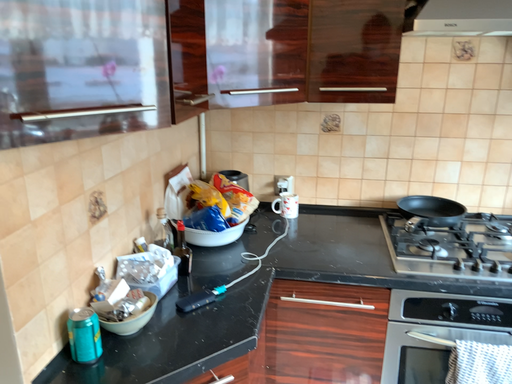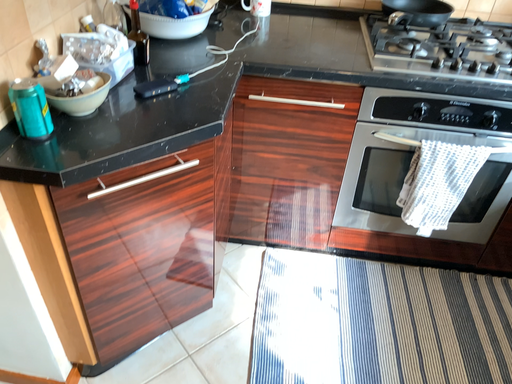
Question: How did the camera likely rotate when shooting the video?

Choices:
 (A) rotated upward
 (B) rotated downward

Answer: (B)